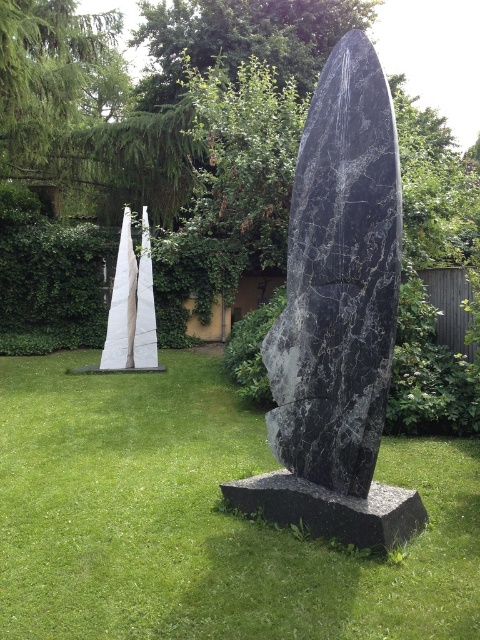
How far apart are black marble sculpture at center and black marble stone at center?

black marble sculpture at center is 62.48 centimeters from black marble stone at center.

Does black marble sculpture at center appear on the left side of black marble stone at center?

In fact, black marble sculpture at center is to the right of black marble stone at center.

Does point (373, 440) lie in front of point (309, 509)?

Yes, it is in front of point (309, 509).

Identify the location of black marble sculpture at center. 338,278.

Which is more to the left, green grass at center or black marble stone at center?

green grass at center

Is green grass at center closer to the viewer compared to black marble stone at center?

No, it is behind black marble stone at center.

In order to click on green grass at center in this screenshot , I will do `click(202, 518)`.

Find the location of a particular element. The width and height of the screenshot is (480, 640). green grass at center is located at coordinates (202, 518).

Does green grass at center appear on the right side of black marble sculpture at center?

Incorrect, green grass at center is not on the right side of black marble sculpture at center.

Is point (200, 589) positioned in front of point (369, 356)?

Yes, it is.

Where is `green grass at center`? The height and width of the screenshot is (640, 480). green grass at center is located at coordinates (202, 518).